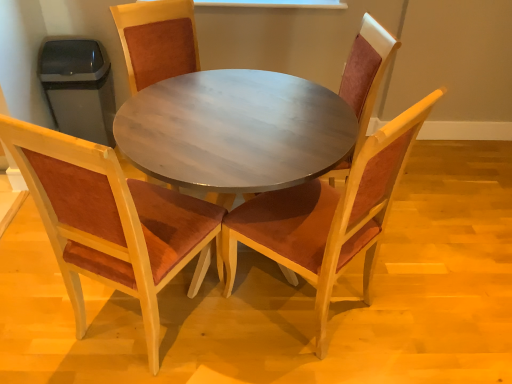
Find the location of a particular element. Image resolution: width=512 pixels, height=384 pixels. vacant area located to the right-hand side of wooden table at center is located at coordinates (426, 276).